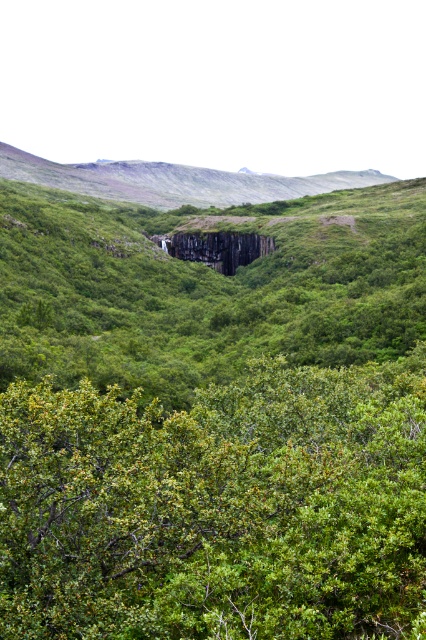
From the picture: You are standing at the point with coordinates point [187,577] and want to walk towards the point with coordinates point [232,244]. Given the dense vegetation in the scene, will you have a clear path to walk directly towards your destination?

Point [187,577] is in front of point [232,244], so you will have a clear path to walk directly towards your destination because the starting point is closer to the viewer than the destination point.

You are standing at the edge of the valley looking towards the center of the image. You see both the green leafy bush at center and the black granite rock at center. Which object is positioned to the right side from your viewpoint?

The green leafy bush at center is positioned to the right of the black granite rock at center from your viewpoint.

You are standing in the lush landscape and want to place a small garden statue that requires a flat, elevated area. Which object between the green leafy bush at center and the black granite rock at center would be more suitable for placing the statue?

The black granite rock at center is taller than the green leafy bush at center, making it a better elevated spot for placing the statue.